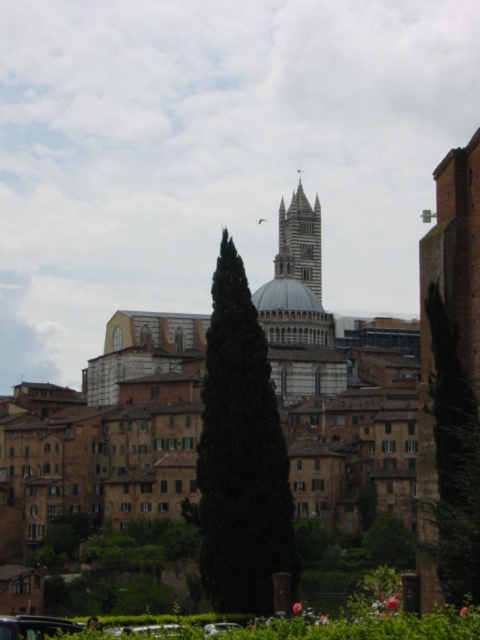
You are a tourist visiting this historic city and want to take a photo that includes both the green leafy tree at center and the stone tower at center. Based on their sizes in the image, which one should you focus on first to ensure both are visible in your shot?

The green leafy tree at center is smaller than the stone tower at center, so you should focus on the stone tower at center first to ensure both are visible in your shot.

You are a tourist standing in front of the white stone tower at center and want to take a photo that includes both it and the metallic silver car at lower left. Considering their sizes, will the car appear smaller in the photo compared to the tower?

The white stone tower at center is much taller than the metallic silver car at lower left, so yes, the metallic silver car at lower left will appear smaller in the photo compared to the tower.